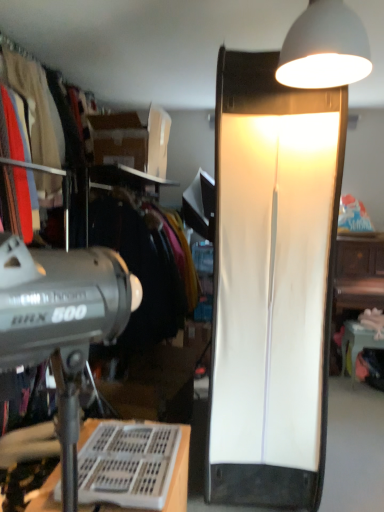
Question: From the image's perspective, is smooth cotton shirt at left, which ranks as the 2th clothing in back-to-front order, located above or below white matte lampshade at upper right, the second lamp when ordered from front to back?

Choices:
 (A) below
 (B) above

Answer: (B)

Question: Considering the positions of smooth cotton shirt at left, which ranks as the 2th clothing in back-to-front order, and white matte lampshade at upper right, the 1th lamp when ordered from bottom to top, in the image, is smooth cotton shirt at left, which ranks as the 2th clothing in back-to-front order, taller or shorter than white matte lampshade at upper right, the 1th lamp when ordered from bottom to top,?

Choices:
 (A) short
 (B) tall

Answer: (A)

Question: Which object is positioned farthest from the white plastic desk at lower left?

Choices:
 (A) matte black clothing at upper left, marked as the second clothing in a front-to-back arrangement
 (B) smooth cotton shirt at left, which ranks as the 2th clothing in back-to-front order
 (C) white glossy table at lower right
 (D) white matte lampshade at upper right, arranged as the 2th lamp when ordered from the bottom
 (E) white matte lampshade at upper right, marked as the 1th lamp in a back-to-front arrangement

Answer: (C)

Question: Which object is positioned farthest from the white plastic desk at lower left?

Choices:
 (A) white matte lampshade at upper right, arranged as the 2th lamp when ordered from the bottom
 (B) matte black clothing at upper left, marked as the first clothing in a back-to-front arrangement
 (C) white matte lampshade at upper right, the second lamp viewed from the top
 (D) white glossy table at lower right
 (E) smooth cotton shirt at left, which ranks as the 2th clothing in back-to-front order

Answer: (D)